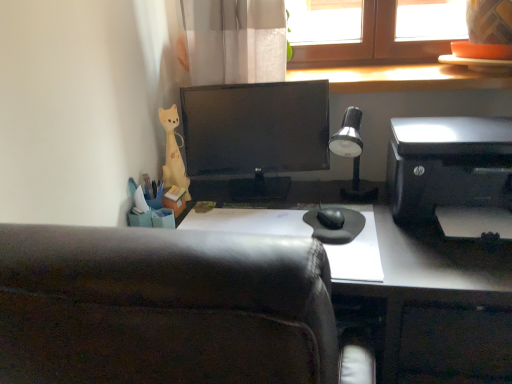
Question: Considering the relative sizes of black plastic printer at right and silver metallic desk lamp at upper right in the image provided, is black plastic printer at right wider than silver metallic desk lamp at upper right?

Choices:
 (A) yes
 (B) no

Answer: (A)

Question: Is black plastic printer at right at the right side of silver metallic desk lamp at upper right?

Choices:
 (A) yes
 (B) no

Answer: (A)

Question: Is black plastic printer at right oriented away from silver metallic desk lamp at upper right?

Choices:
 (A) yes
 (B) no

Answer: (B)

Question: Is the depth of black plastic printer at right greater than that of silver metallic desk lamp at upper right?

Choices:
 (A) yes
 (B) no

Answer: (B)

Question: From the image's perspective, would you say black plastic printer at right is positioned over silver metallic desk lamp at upper right?

Choices:
 (A) no
 (B) yes

Answer: (A)

Question: Is black plastic printer at right far from silver metallic desk lamp at upper right?

Choices:
 (A) no
 (B) yes

Answer: (A)

Question: Can you confirm if silver metallic desk lamp at upper right is shorter than wooden at upper right?

Choices:
 (A) yes
 (B) no

Answer: (B)

Question: Could you tell me if silver metallic desk lamp at upper right is turned towards wooden at upper right?

Choices:
 (A) no
 (B) yes

Answer: (A)

Question: Is silver metallic desk lamp at upper right in front of wooden at upper right?

Choices:
 (A) no
 (B) yes

Answer: (B)

Question: Does silver metallic desk lamp at upper right have a larger size compared to wooden at upper right?

Choices:
 (A) yes
 (B) no

Answer: (B)

Question: Is wooden at upper right located within silver metallic desk lamp at upper right?

Choices:
 (A) no
 (B) yes

Answer: (A)

Question: Does silver metallic desk lamp at upper right have a greater width compared to wooden at upper right?

Choices:
 (A) no
 (B) yes

Answer: (A)

Question: Does wooden at upper right have a greater width compared to silver metallic desk lamp at upper right?

Choices:
 (A) no
 (B) yes

Answer: (B)